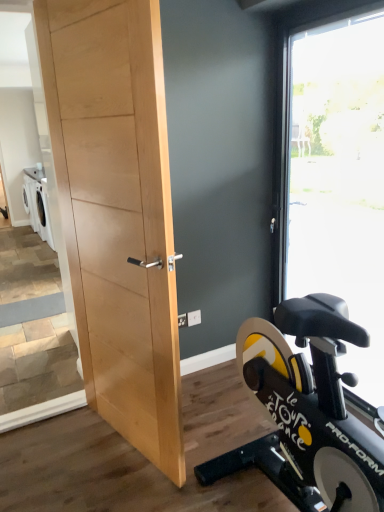
Where is `vacant region to the right of natural wood door at center`? vacant region to the right of natural wood door at center is located at coordinates [216, 444].